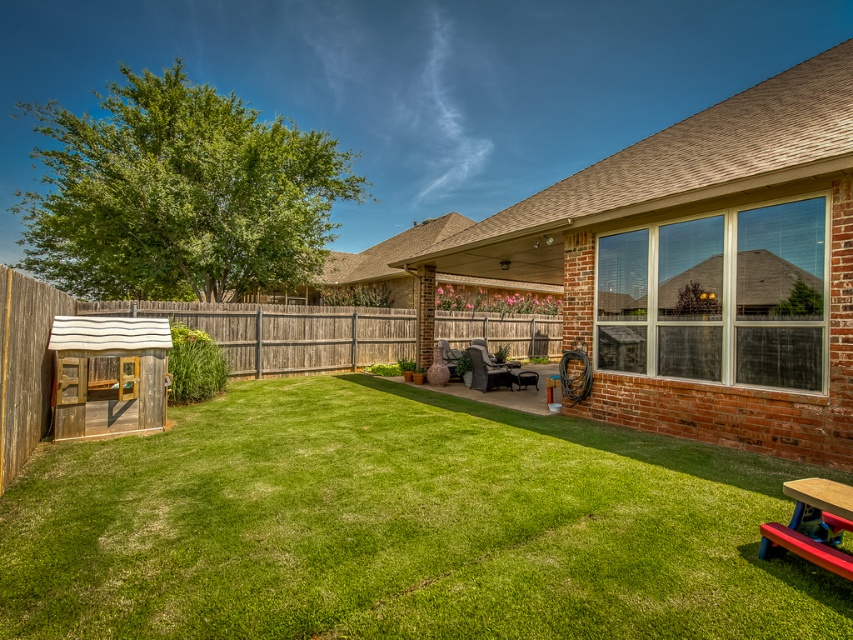
You are standing at the entrance of the backyard and want to place a new garden statue exactly at the coordinates mentioned for the green grass at center. What are the coordinates where you should place the statue?

The coordinates for the green grass at center are 0.823 in the x direction and 0.471 in the y direction, so you should place the garden statue at those coordinates.

You are planning to install a new garden bed in the backyard. The garden bed requires a space that is not occupied by any existing structures. Based on the scene, which object between the brown brick shed at center and the wooden fence at left would you consider moving or adjusting to create more space?

The brown brick shed at center is larger in size than the wooden fence at left, so moving or adjusting the brown brick shed at center would likely create more space for the new garden bed.